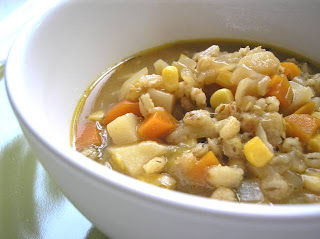
This screenshot has width=320, height=239. In order to click on bowl in this screenshot , I will do (x=49, y=87).